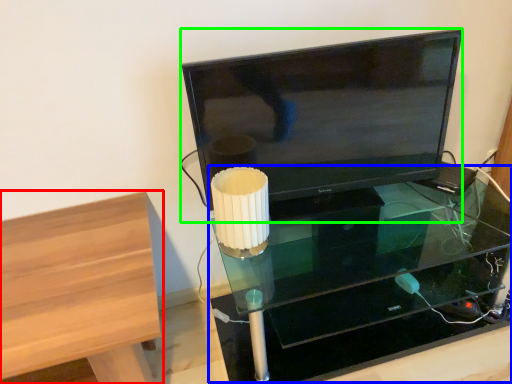
Question: Estimate the real-world distances between objects in this image. Which object is closer to furniture (highlighted by a red box), table (highlighted by a blue box) or television (highlighted by a green box)?

Choices:
 (A) table
 (B) television

Answer: (B)